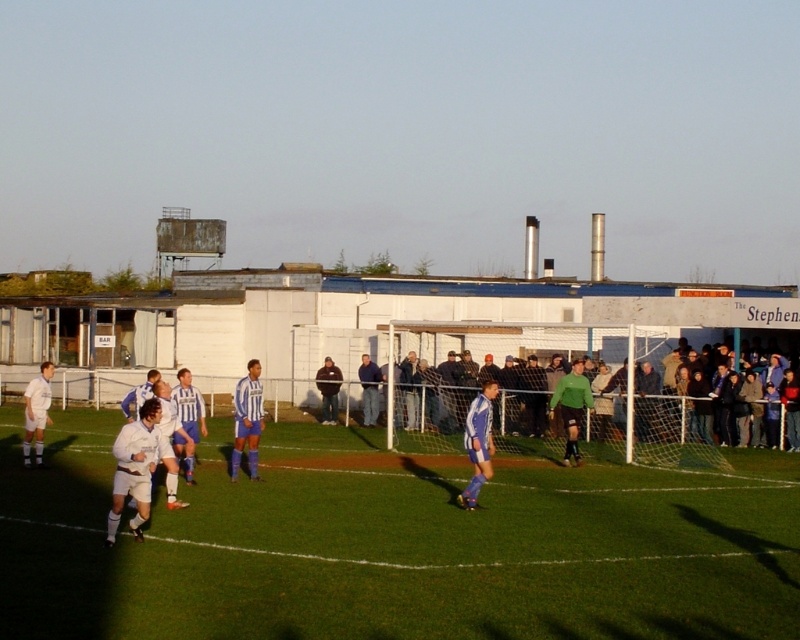
Question: Estimate the real-world distances between objects in this image. Which object is farther from the white matte soccer player at left?

Choices:
 (A) dark blue jacket at center
 (B) blue striped jersey at center
 (C) blue/white striped jersey at center

Answer: (A)

Question: Can you confirm if blue striped jersey at center is wider than dark blue jacket at center?

Choices:
 (A) yes
 (B) no

Answer: (A)

Question: Which object is the farthest from the blue striped jersey at center?

Choices:
 (A) white matte soccer player at center
 (B) blue/white striped jersey at center
 (C) white matte soccer player at left

Answer: (A)

Question: Estimate the real-world distances between objects in this image. Which object is closer to the white matte soccer player at center?

Choices:
 (A) striped jersey at center
 (B) blue/white striped jersey at center
 (C) dark blue jacket at center

Answer: (B)

Question: Does white fabric soccer field at center have a lesser width compared to white matte soccer player at left?

Choices:
 (A) no
 (B) yes

Answer: (A)

Question: In this image, where is white matte soccer player at center located relative to blue striped jersey at center?

Choices:
 (A) left
 (B) right

Answer: (B)